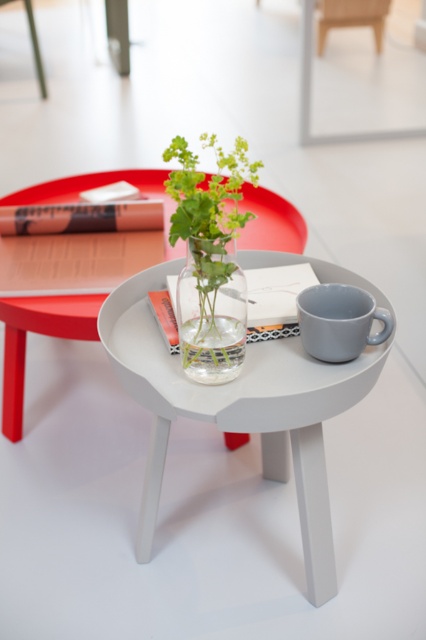
You are standing in the room and want to place a new decorative item on the white matte side table at center. Considering the current objects on the table, where should you position the new item to ensure it doesn not obstruct the view of the glass vase and the gray ceramic mug?

The white matte side table at center has the glass vase and gray ceramic mug already placed. To avoid obstructing their view, position the new item either to the side or behind these objects, ensuring it does not block the line of sight from the front of the table.

You are arranging flowers in the transparent glass vase at center and need to place the green matte plant at center nearby. Considering their sizes, which object should you place first to ensure they fit well in the space?

The transparent glass vase at center is smaller than the green matte plant at center, so you should place the green matte plant at center first to accommodate its larger size before arranging the smaller vase.

You are standing in the room depicted in the image. There is a point marked at coordinates (212,310). What object is located at that point?

The point at coordinates (212,310) marks the transparent glass vase at center.